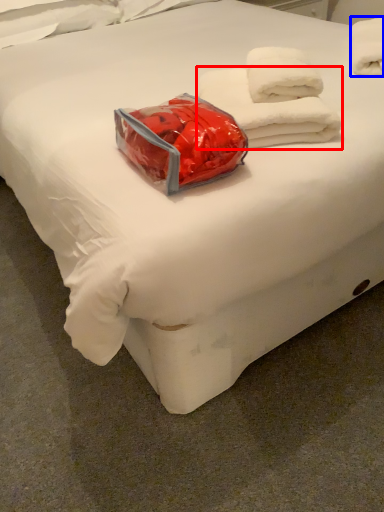
Question: Which point is further to the camera, towel (highlighted by a red box) or towel (highlighted by a blue box)?

Choices:
 (A) towel
 (B) towel

Answer: (B)